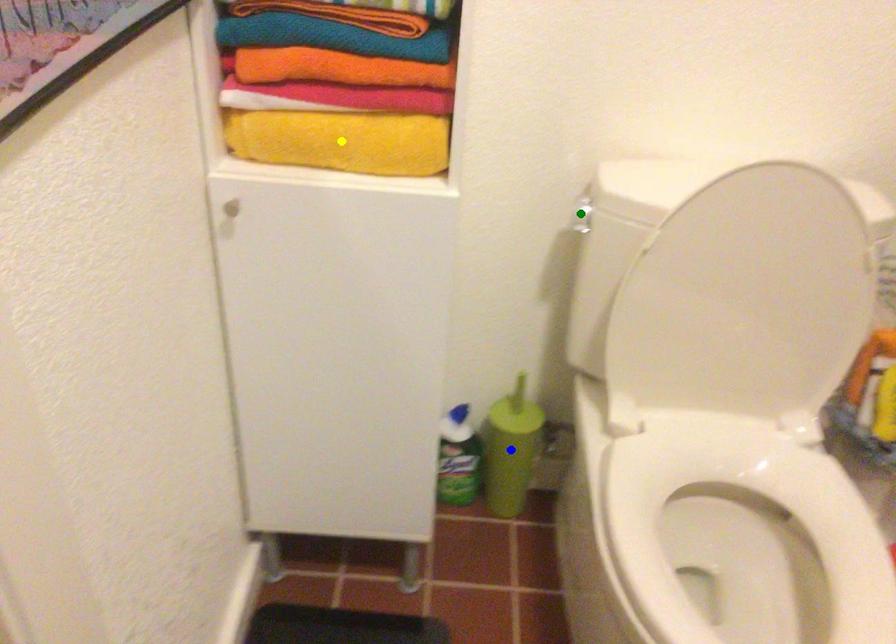
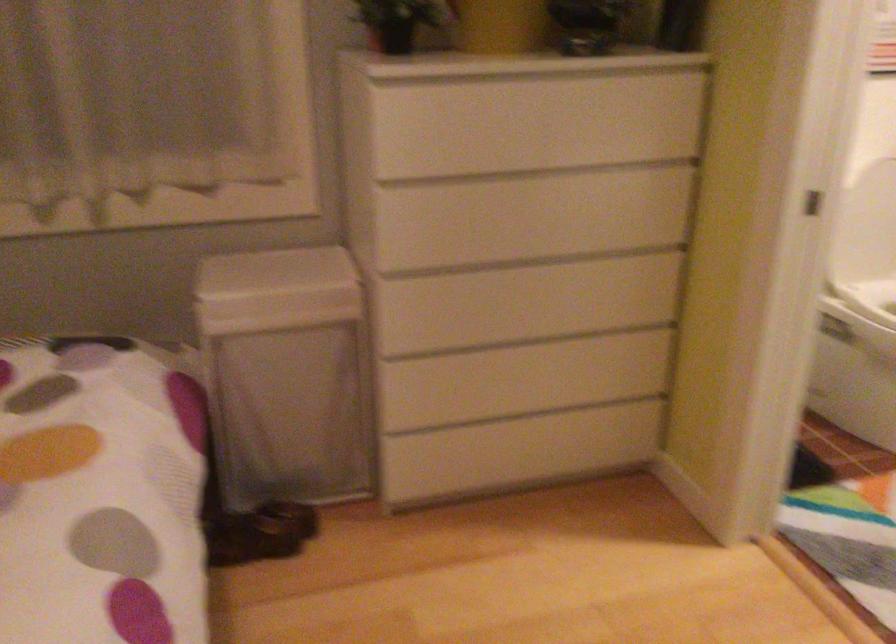
I am providing you with two images of the same scene from different viewpoints. Three points are marked in image1. Which point corresponds to a part or object that is occluded in image2?In image1, three points are marked. Which of them correspond to a part or object that is occluded in image2?Among the three points shown in image1, which one corresponds to a part or object that is no longer visible due to occlusion in image2?

Invisible in image2: yellow point, green point, blue point.